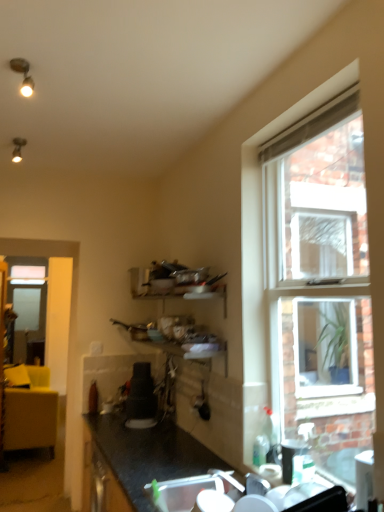
Question: Can you confirm if transparent glass screen door at left is smaller than black plastic cup at lower right, which is the second appliance from left to right?

Choices:
 (A) no
 (B) yes

Answer: (A)

Question: From the image's perspective, is transparent glass screen door at left above black plastic cup at lower right, which is the second appliance from left to right?

Choices:
 (A) no
 (B) yes

Answer: (A)

Question: Can you confirm if transparent glass screen door at left is taller than black plastic cup at lower right, the first appliance in the front-to-back sequence?

Choices:
 (A) no
 (B) yes

Answer: (B)

Question: Does transparent glass screen door at left contain black plastic cup at lower right, the first appliance in the right-to-left sequence?

Choices:
 (A) yes
 (B) no

Answer: (B)

Question: From a real-world perspective, is transparent glass screen door at left positioned over black plastic cup at lower right, the first appliance in the front-to-back sequence, based on gravity?

Choices:
 (A) yes
 (B) no

Answer: (A)

Question: Does point (301, 439) appear closer or farther from the camera than point (18, 292)?

Choices:
 (A) closer
 (B) farther

Answer: (A)

Question: Looking at their shapes, would you say black plastic cup at lower right, which is the second appliance from left to right, is wider or thinner than transparent glass screen door at left?

Choices:
 (A) thin
 (B) wide

Answer: (B)

Question: Considering the positions of black plastic cup at lower right, the first appliance in the right-to-left sequence, and transparent glass screen door at left in the image, is black plastic cup at lower right, the first appliance in the right-to-left sequence, taller or shorter than transparent glass screen door at left?

Choices:
 (A) short
 (B) tall

Answer: (A)

Question: From a real-world perspective, is black plastic cup at lower right, the first appliance in the right-to-left sequence, physically located above or below transparent glass screen door at left?

Choices:
 (A) above
 (B) below

Answer: (B)

Question: Considering the positions of black plastic cup at lower right, arranged as the 2th appliance when viewed from the back, and white plastic sink at lower center in the image, is black plastic cup at lower right, arranged as the 2th appliance when viewed from the back, bigger or smaller than white plastic sink at lower center?

Choices:
 (A) big
 (B) small

Answer: (B)

Question: From a real-world perspective, is black plastic cup at lower right, the first appliance in the right-to-left sequence, positioned above or below white plastic sink at lower center?

Choices:
 (A) above
 (B) below

Answer: (A)

Question: Is black plastic cup at lower right, which is the second appliance from left to right, spatially inside white plastic sink at lower center, or outside of it?

Choices:
 (A) outside
 (B) inside

Answer: (A)

Question: Is black plastic cup at lower right, the first appliance in the right-to-left sequence, taller or shorter than white plastic sink at lower center?

Choices:
 (A) short
 (B) tall

Answer: (B)

Question: Choose the correct answer: Is transparent glass screen door at left inside satin black coffee maker at center, the 2th appliance when ordered from right to left, or outside it?

Choices:
 (A) inside
 (B) outside

Answer: (B)

Question: Considering the positions of transparent glass screen door at left and satin black coffee maker at center, the 1th appliance in the back-to-front sequence, in the image, is transparent glass screen door at left wider or thinner than satin black coffee maker at center, the 1th appliance in the back-to-front sequence,?

Choices:
 (A) thin
 (B) wide

Answer: (A)